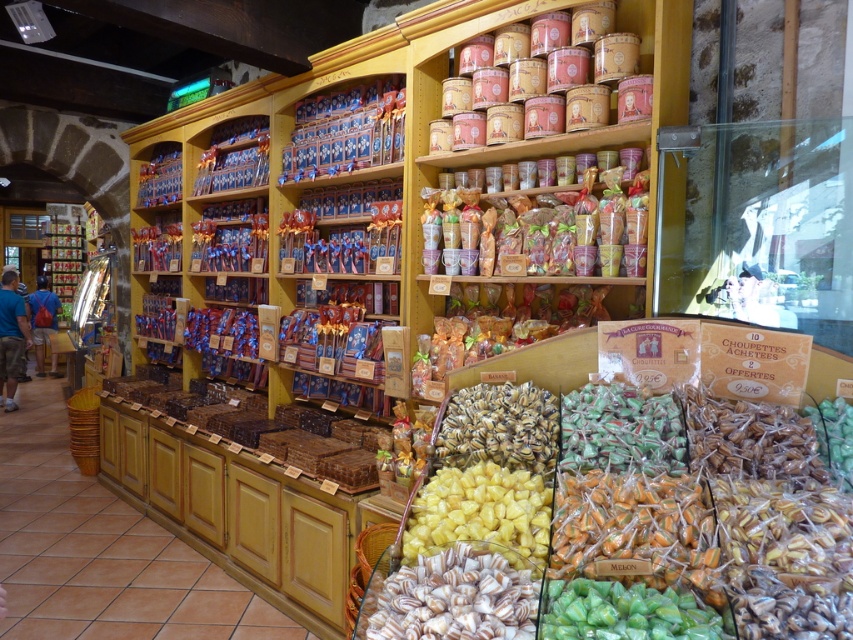
Question: Which of the following is the closest to the observer?

Choices:
 (A) brown matte candy at center
 (B) white glossy candy at center

Answer: (B)

Question: Is white glossy candy at center below yellow sugary candy at center?

Choices:
 (A) no
 (B) yes

Answer: (B)

Question: Is pink cardboard boxes at upper center wider than translucent plastic bag at center?

Choices:
 (A) yes
 (B) no

Answer: (B)

Question: Is pink cardboard boxes at upper center above green glossy candy at center?

Choices:
 (A) yes
 (B) no

Answer: (A)

Question: Which point is farther to the camera?

Choices:
 (A) translucent plastic bag at center
 (B) brown matte candy at center
 (C) pink cardboard boxes at upper center

Answer: (A)

Question: Estimate the real-world distances between objects in this image. Which object is closer to the white glossy candy at center?

Choices:
 (A) brown matte candy at center
 (B) pink cardboard boxes at upper center
 (C) yellow sugary candy at center
 (D) translucent plastic bag at center

Answer: (C)